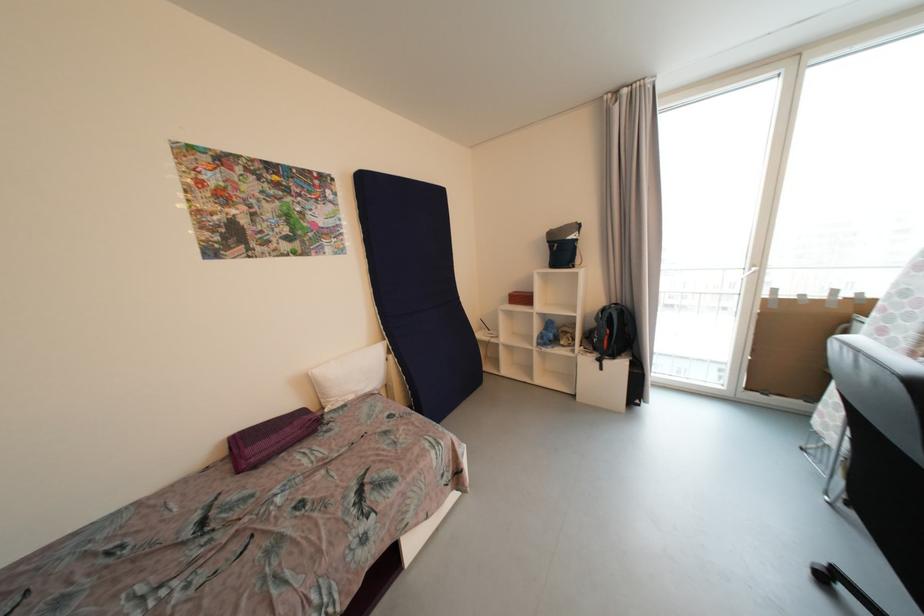
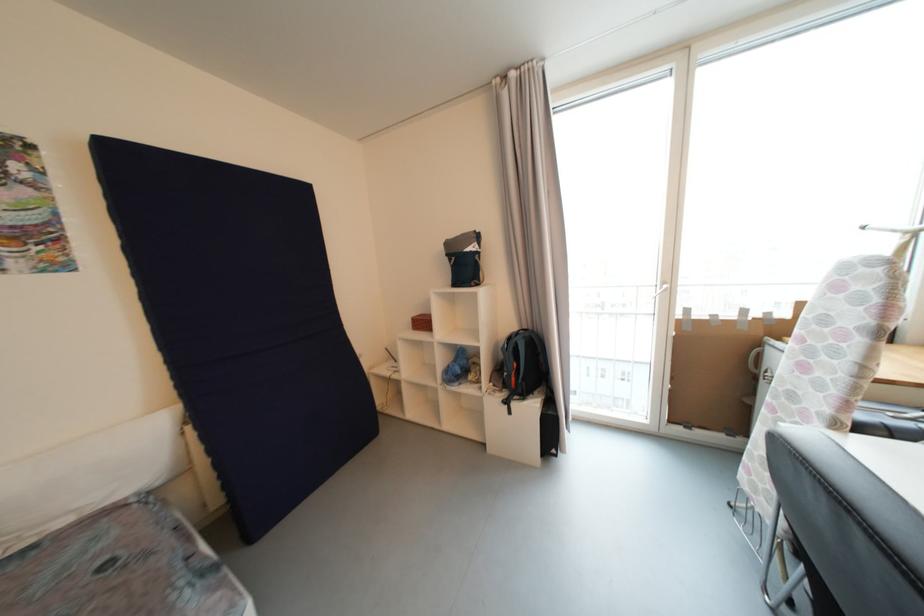
Question: The camera is either moving clockwise (left) or counter-clockwise (right) around the object. The first image is from the beginning of the video and the second image is from the end. Is the camera moving left or right when shooting the video?

Choices:
 (A) Left
 (B) Right

Answer: (A)